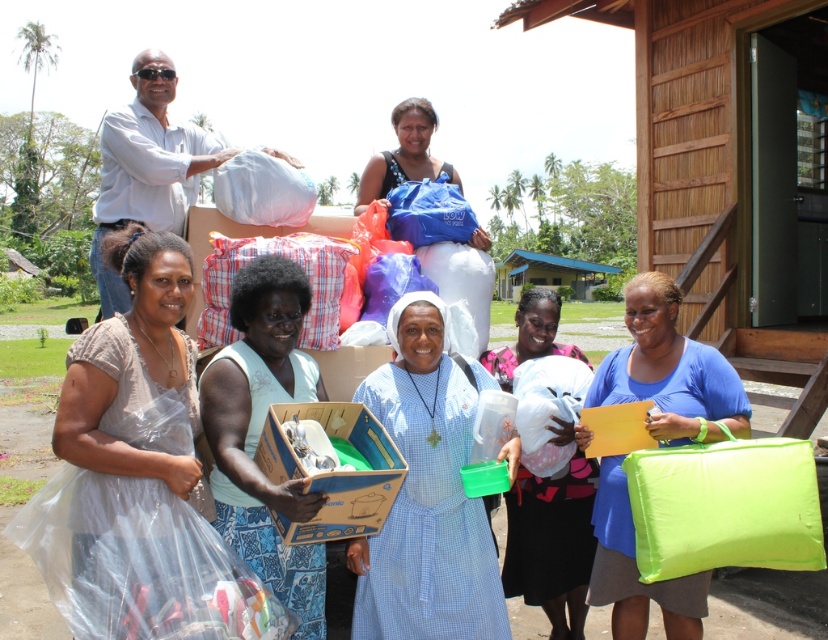
Question: Which point is farther from the camera taking this photo?

Choices:
 (A) (398, 108)
 (B) (153, 177)
 (C) (306, 406)

Answer: (A)

Question: Is neon green fabric pillow at lower right positioned behind blue cardboard box at center?

Choices:
 (A) no
 (B) yes

Answer: (B)

Question: Is white tulle dress at lower left thinner than blue cardboard box at center?

Choices:
 (A) no
 (B) yes

Answer: (A)

Question: Which of the following is the farthest from the observer?

Choices:
 (A) light blue fabric at center
 (B) blue cardboard box at center
 (C) white fabric bag at center

Answer: (C)

Question: Which point is closer to the camera?

Choices:
 (A) (367, 506)
 (B) (160, 60)
 (C) (699, 392)

Answer: (A)

Question: Does blue checkered dress at center have a lesser width compared to blue fabric bag at center?

Choices:
 (A) no
 (B) yes

Answer: (B)